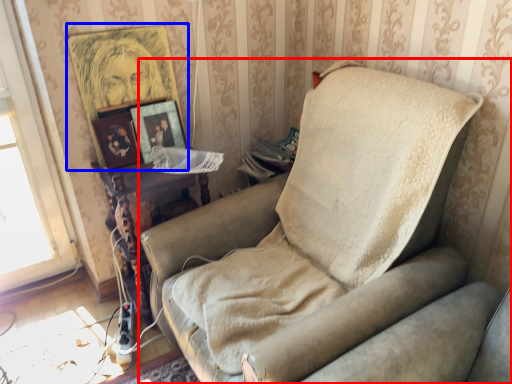
Question: Which of the following is the closest to the observer, studio couch (highlighted by a red box) or picture frame (highlighted by a blue box)?

Choices:
 (A) studio couch
 (B) picture frame

Answer: (A)